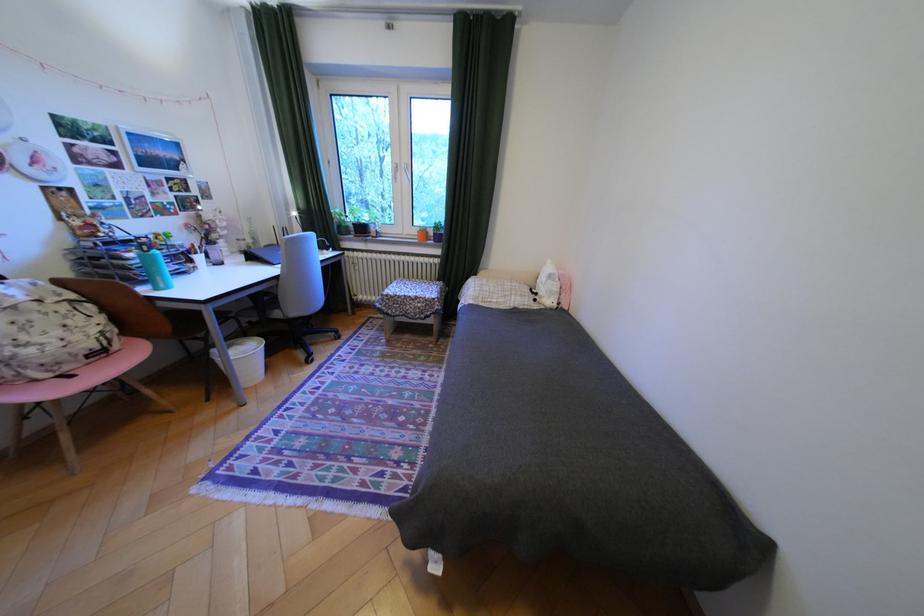
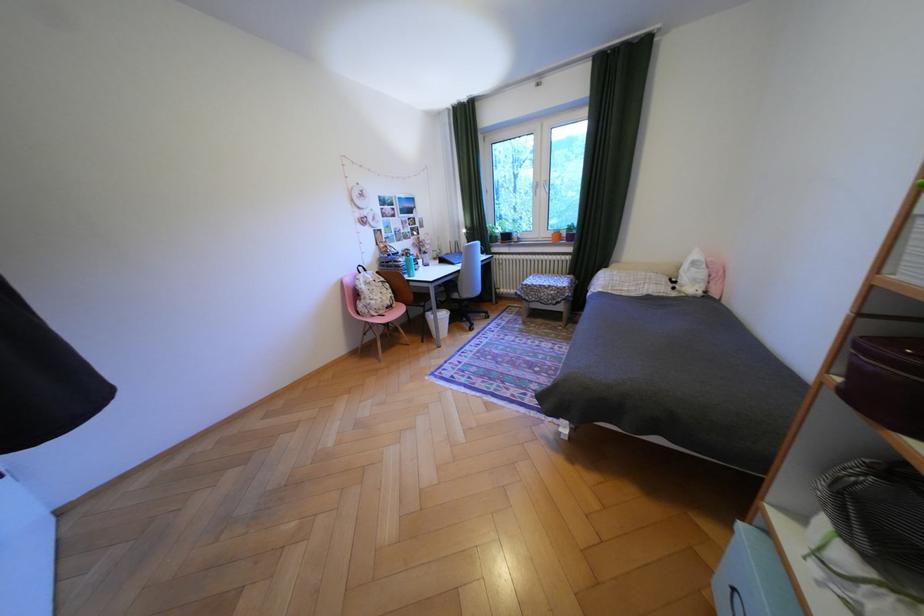
Find the pixel in the second image that matches point 410,174 in the first image.

(551, 190)